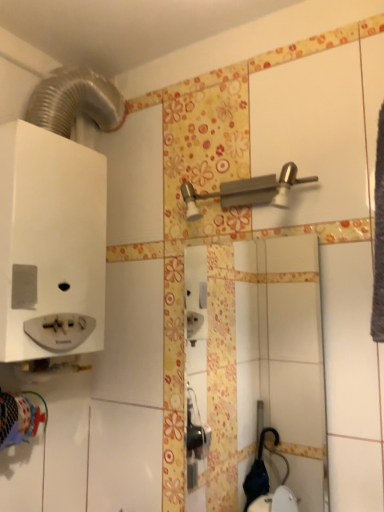
The height and width of the screenshot is (512, 384). What are the coordinates of `white glossy mirror at center` in the screenshot? It's located at (283, 355).

This screenshot has height=512, width=384. What do you see at coordinates (283, 355) in the screenshot?
I see `white glossy mirror at center` at bounding box center [283, 355].

What do you see at coordinates (248, 191) in the screenshot? I see `satin nickel shower at upper center` at bounding box center [248, 191].

The image size is (384, 512). Identify the location of satin nickel shower at upper center. (248, 191).

The width and height of the screenshot is (384, 512). I want to click on white glossy mirror at center, so click(283, 355).

Is white glossy mirror at center to the left or to the right of satin nickel shower at upper center in the image?

Clearly, white glossy mirror at center is on the right of satin nickel shower at upper center in the image.

Considering their positions, is white glossy mirror at center located in front of or behind satin nickel shower at upper center?

In the image, white glossy mirror at center appears behind satin nickel shower at upper center.

Which is closer, (296, 364) or (194, 211)?

Positioned in front is point (194, 211).

From the image's perspective, which is below, white glossy mirror at center or satin nickel shower at upper center?

white glossy mirror at center is shown below in the image.

From a real-world perspective, is white glossy mirror at center physically below satin nickel shower at upper center?

Yes.

Between white glossy mirror at center and satin nickel shower at upper center, which one has smaller width?

white glossy mirror at center is thinner.

Can you confirm if white glossy mirror at center is shorter than satin nickel shower at upper center?

No, white glossy mirror at center is not shorter than satin nickel shower at upper center.

Based on their sizes in the image, would you say white glossy mirror at center is bigger or smaller than satin nickel shower at upper center?

In the image, white glossy mirror at center appears to be smaller than satin nickel shower at upper center.

Could satin nickel shower at upper center be considered to be inside white glossy mirror at center?

Actually, satin nickel shower at upper center is outside white glossy mirror at center.

Can you see white glossy mirror at center touching satin nickel shower at upper center?

No, white glossy mirror at center is not in contact with satin nickel shower at upper center.

Consider the image. Is white glossy mirror at center turned away from satin nickel shower at upper center?

No, white glossy mirror at center is not facing away from satin nickel shower at upper center.

From the picture: How different are the orientations of white glossy mirror at center and satin nickel shower at upper center in degrees?

The angle between the facing direction of white glossy mirror at center and the facing direction of satin nickel shower at upper center is 0.111 degrees.

At what (x,y) coordinates should I click in order to perform the action: click on mirror below the satin nickel shower at upper center (from a real-world perspective). Please return your answer as a coordinate pair (x, y). This screenshot has width=384, height=512. Looking at the image, I should click on (283, 355).

Is satin nickel shower at upper center to the right of white glossy mirror at center from the viewer's perspective?

No, satin nickel shower at upper center is not to the right of white glossy mirror at center.

Who is more distant, satin nickel shower at upper center or white glossy mirror at center?

white glossy mirror at center is further away from the camera.

Is point (256, 193) farther from camera compared to point (242, 282)?

That is False.

From the image's perspective, does satin nickel shower at upper center appear lower than white glossy mirror at center?

Actually, satin nickel shower at upper center appears above white glossy mirror at center in the image.

From a real-world perspective, which object stands above the other?

In real-world perspective, satin nickel shower at upper center is above.

Considering the sizes of objects satin nickel shower at upper center and white glossy mirror at center in the image provided, who is wider, satin nickel shower at upper center or white glossy mirror at center?

With larger width is satin nickel shower at upper center.

From the picture: Is satin nickel shower at upper center shorter than white glossy mirror at center?

Yes.

Does satin nickel shower at upper center have a larger size compared to white glossy mirror at center?

Yes, satin nickel shower at upper center is bigger than white glossy mirror at center.

Is satin nickel shower at upper center positioned beyond the bounds of white glossy mirror at center?

Absolutely, satin nickel shower at upper center is external to white glossy mirror at center.

Is satin nickel shower at upper center touching white glossy mirror at center?

They are not placed beside each other.

Does satin nickel shower at upper center turn towards white glossy mirror at center?

No.

Identify the location of mirror behind the satin nickel shower at upper center. (283, 355).

You are a GUI agent. You are given a task and a screenshot of the screen. Output one action in this format:
    pyautogui.click(x=<x>, y=<y>)
    Task: Click on the mirror lying behind the satin nickel shower at upper center
    This screenshot has height=512, width=384.
    Given the screenshot: What is the action you would take?
    pyautogui.click(x=283, y=355)

I want to click on mirror located underneath the satin nickel shower at upper center (from a real-world perspective), so click(283, 355).